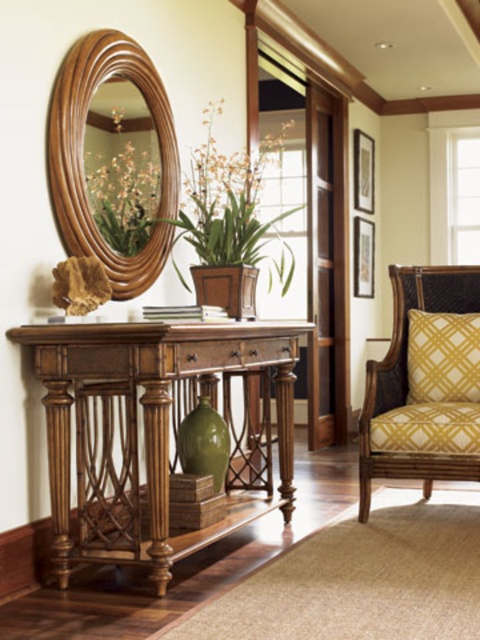
Question: Among these points, which one is nearest to the camera?

Choices:
 (A) (460, 388)
 (B) (54, 522)
 (C) (372, 458)
 (D) (142, 65)

Answer: (B)

Question: Is yellow fabric armchair at right bigger than yellow woven cushion at right?

Choices:
 (A) yes
 (B) no

Answer: (A)

Question: Which point is farther to the camera?

Choices:
 (A) (247, 392)
 (B) (458, 460)
 (C) (420, 371)
 (D) (240, 248)

Answer: (A)

Question: Estimate the real-world distances between objects in this image. Which object is farther from the wooden oval mirror at upper left?

Choices:
 (A) yellow woven cushion at right
 (B) green matte vase at center
 (C) mahogany wood console table at center
 (D) yellow fabric armchair at right

Answer: (A)

Question: Can you confirm if yellow fabric armchair at right is smaller than wooden oval mirror at upper left?

Choices:
 (A) yes
 (B) no

Answer: (B)

Question: Is yellow fabric armchair at right wider than wooden oval mirror at upper left?

Choices:
 (A) no
 (B) yes

Answer: (B)